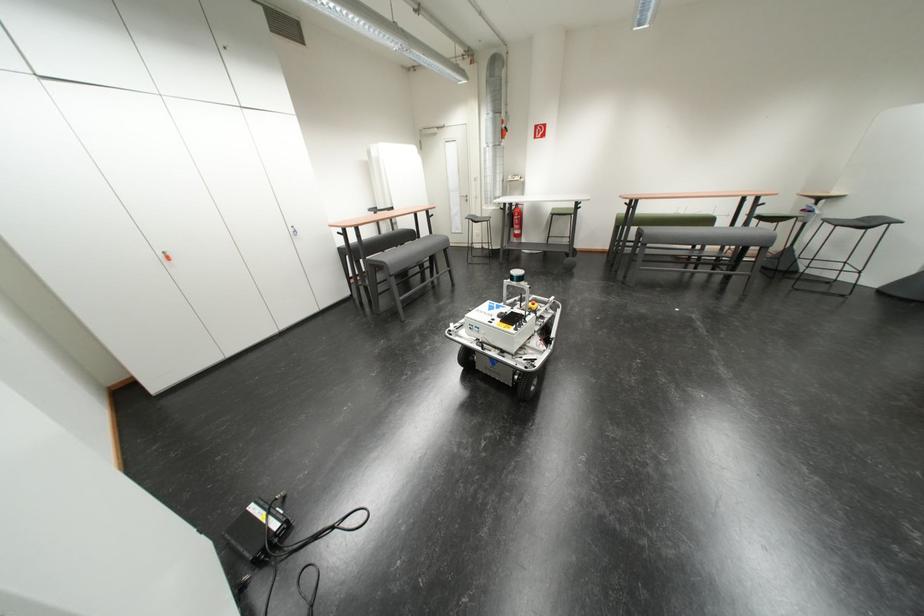
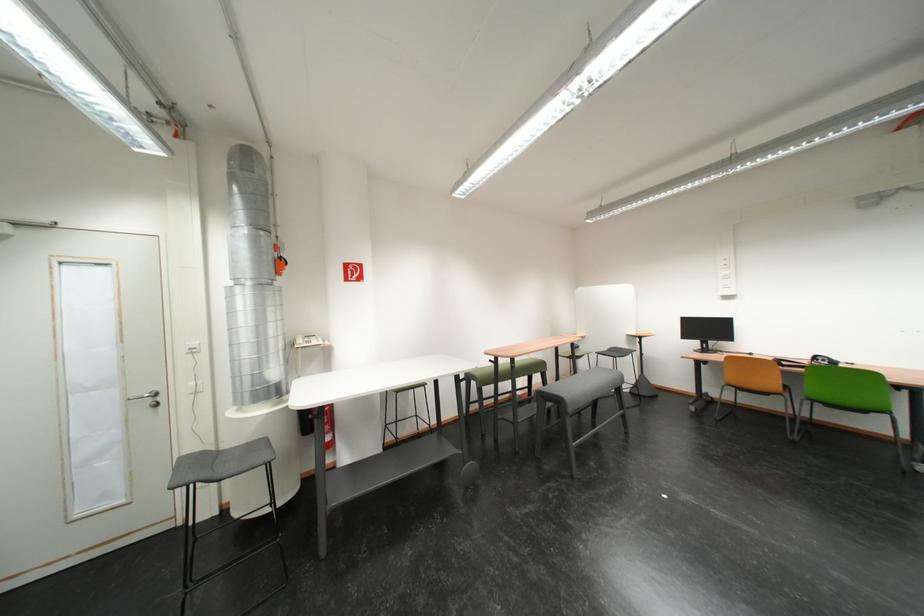
Where in the second image is the point corresponding to point (512, 134) from the first image?

(284, 265)